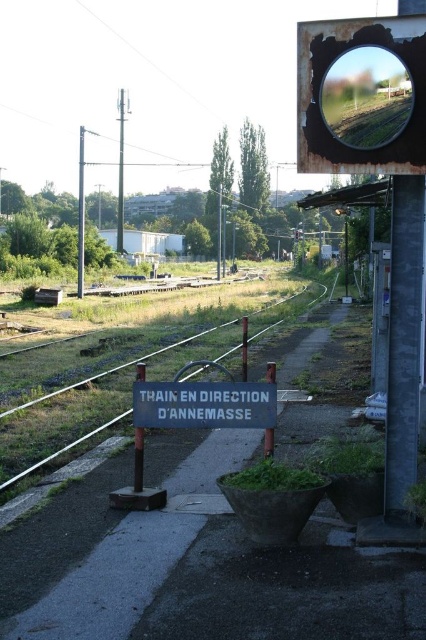
Question: Is blue painted wood sign at center wider than metal train track at left?

Choices:
 (A) yes
 (B) no

Answer: (B)

Question: Among these points, which one is nearest to the camera?

Choices:
 (A) (155, 381)
 (B) (138, 480)

Answer: (B)

Question: Can you confirm if metal train track at left is positioned below blue painted metal pole at center?

Choices:
 (A) no
 (B) yes

Answer: (A)

Question: Which point is farther from the camera taking this photo?

Choices:
 (A) (172, 390)
 (B) (55, 452)
 (C) (138, 378)

Answer: (B)

Question: Which point is farther to the camera?

Choices:
 (A) (138, 464)
 (B) (169, 392)
 (C) (83, 216)
 (D) (25, 468)

Answer: (C)

Question: Can you confirm if metal train track at left is smaller than blue painted metal pole at center?

Choices:
 (A) yes
 (B) no

Answer: (B)